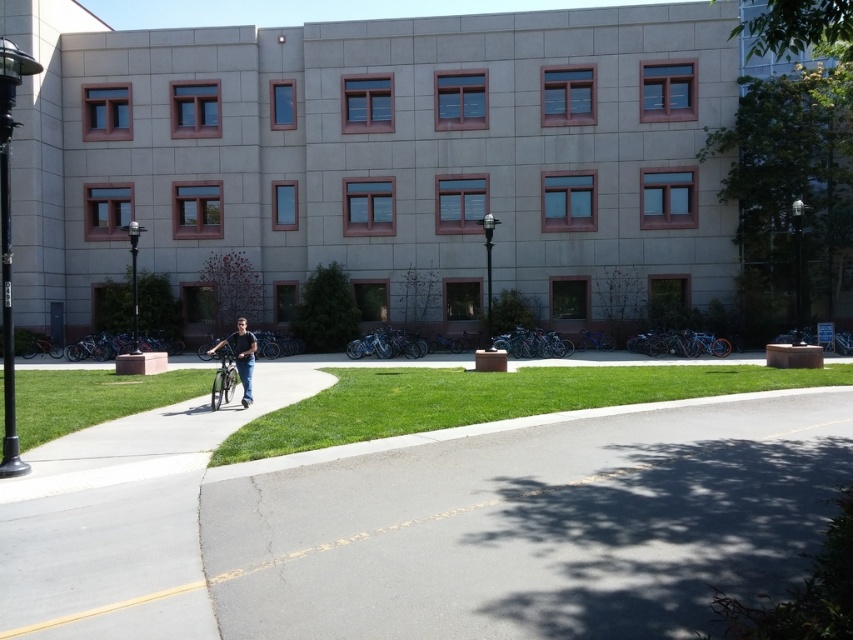
Question: Which of the following is the farthest from the observer?

Choices:
 (A) jeans at center
 (B) silver metallic bicycle at center

Answer: (A)

Question: Is gray asphalt road at lower center wider than jeans at center?

Choices:
 (A) no
 (B) yes

Answer: (B)

Question: Which object is positioned closest to the silver metallic bicycle at center?

Choices:
 (A) green grass at center
 (B) gray asphalt road at lower center
 (C) jeans at center

Answer: (C)

Question: Which of the following is the farthest from the observer?

Choices:
 (A) (329, 416)
 (B) (236, 317)
 (C) (218, 396)

Answer: (B)

Question: Where is green grass at center located in relation to silver metallic bicycle at center in the image?

Choices:
 (A) above
 (B) below

Answer: (B)

Question: Can you confirm if gray asphalt road at lower center is positioned below green grass at center?

Choices:
 (A) yes
 (B) no

Answer: (A)